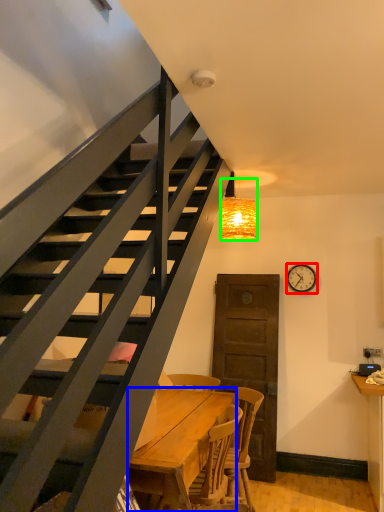
Question: Which is farther away from clock (highlighted by a red box)? desk (highlighted by a blue box) or lamp (highlighted by a green box)?

Choices:
 (A) desk
 (B) lamp

Answer: (A)